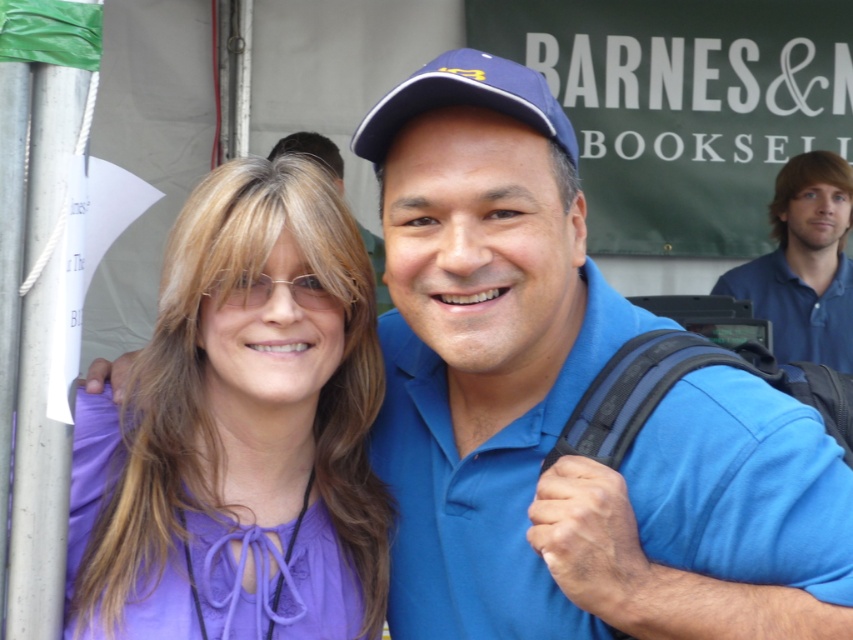
Question: Can you confirm if blue cotton shirt at upper right is positioned to the left of blue fabric baseball cap at center?

Choices:
 (A) no
 (B) yes

Answer: (A)

Question: Can you confirm if purple silky blouse at center is positioned to the right of blue cotton shirt at upper right?

Choices:
 (A) yes
 (B) no

Answer: (B)

Question: Does blue cotton shirt at upper right have a smaller size compared to blue fabric baseball cap at center?

Choices:
 (A) yes
 (B) no

Answer: (B)

Question: Among these points, which one is farthest from the camera?

Choices:
 (A) click(393, 124)
 (B) click(820, 129)

Answer: (B)

Question: Which object is closer to the camera taking this photo?

Choices:
 (A) purple silky blouse at center
 (B) green fabric sign at upper center

Answer: (A)

Question: Which object is the farthest from the blue fabric baseball cap at center?

Choices:
 (A) green fabric sign at upper center
 (B) purple silky blouse at center

Answer: (A)